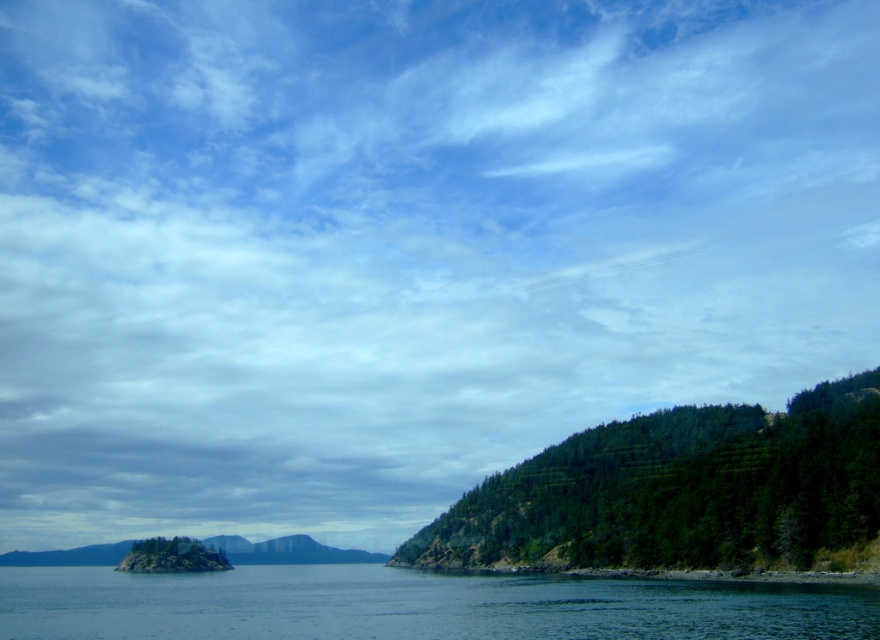
Question: Can you confirm if clear blue water at lower center is positioned below green forested mountain at lower left?

Choices:
 (A) yes
 (B) no

Answer: (B)

Question: Among these objects, which one is nearest to the camera?

Choices:
 (A) green forested mountain at lower left
 (B) green textured hillside at right

Answer: (B)

Question: From the image, what is the correct spatial relationship of clear blue water at lower center in relation to green forested mountain at lower left?

Choices:
 (A) below
 (B) above

Answer: (B)

Question: Is clear blue water at lower center below green forested mountain at lower left?

Choices:
 (A) yes
 (B) no

Answer: (B)

Question: Which object is closer to the camera taking this photo?

Choices:
 (A) green forested mountain at lower left
 (B) clear blue water at lower center
 (C) green textured hillside at right

Answer: (B)

Question: Among these points, which one is farthest from the camera?

Choices:
 (A) (834, 595)
 (B) (272, 540)
 (C) (763, 484)

Answer: (B)